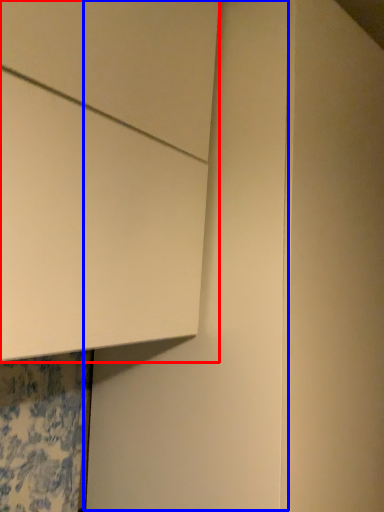
Question: Which of the following is the farthest to the observer, cabinetry (highlighted by a red box) or door (highlighted by a blue box)?

Choices:
 (A) cabinetry
 (B) door

Answer: (B)